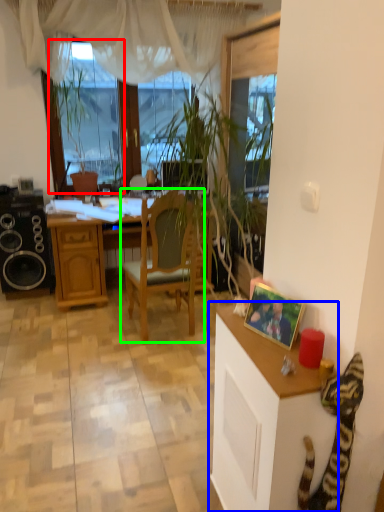
Question: Which object is positioned farthest from window screen (highlighted by a red box)? Select from cabinetry (highlighted by a blue box) and chair (highlighted by a green box).

Choices:
 (A) cabinetry
 (B) chair

Answer: (A)